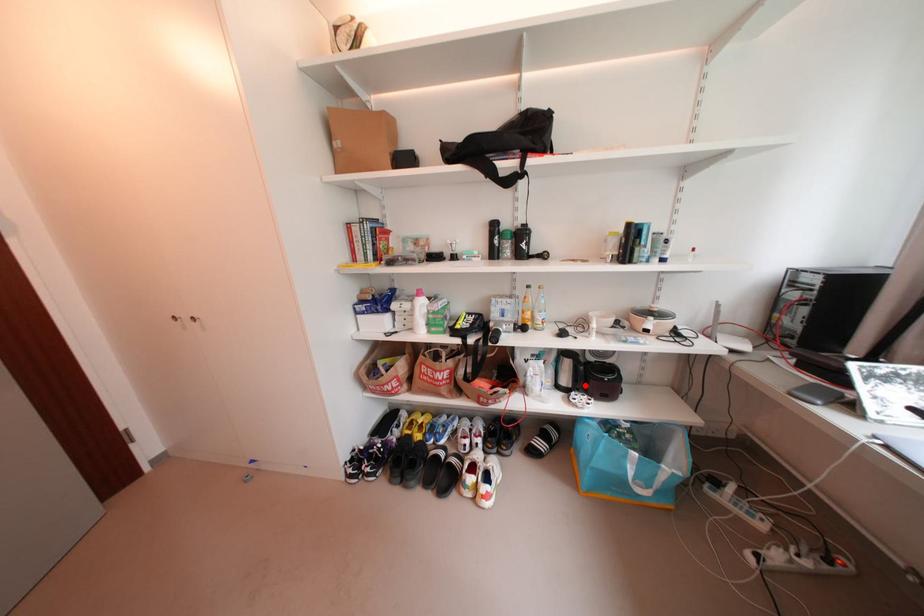
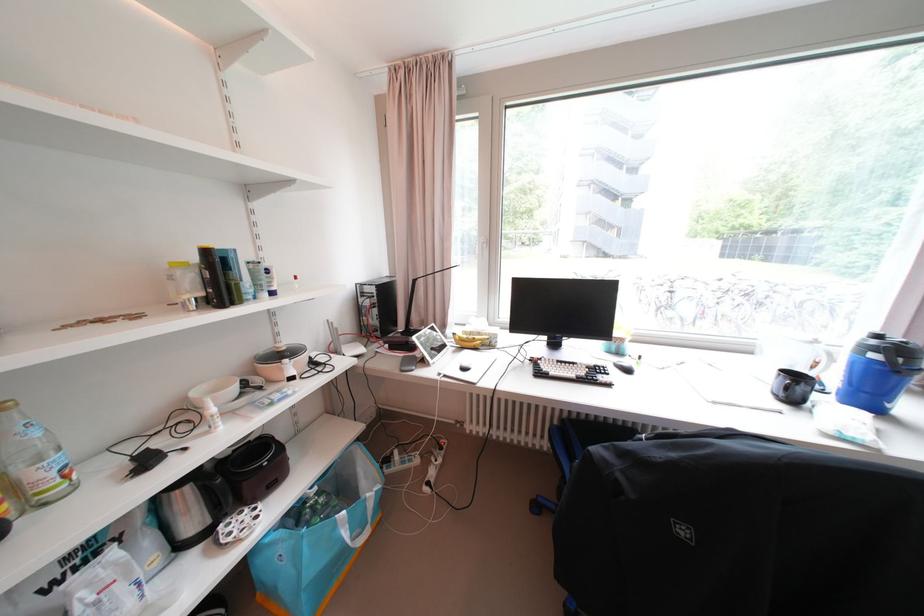
The point at the highlighted location is marked in the first image. Where is the corresponding point in the second image?

(229, 511)